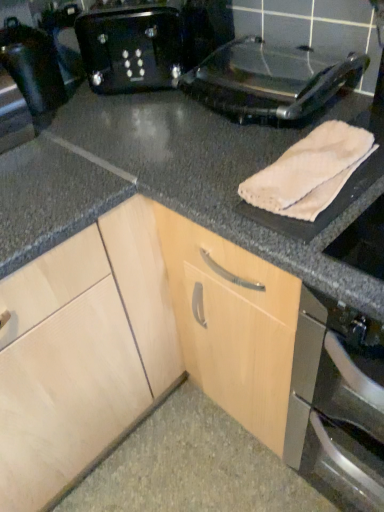
Find the location of a particular element. The width and height of the screenshot is (384, 512). free spot to the left of beige soft towel at upper right is located at coordinates (207, 179).